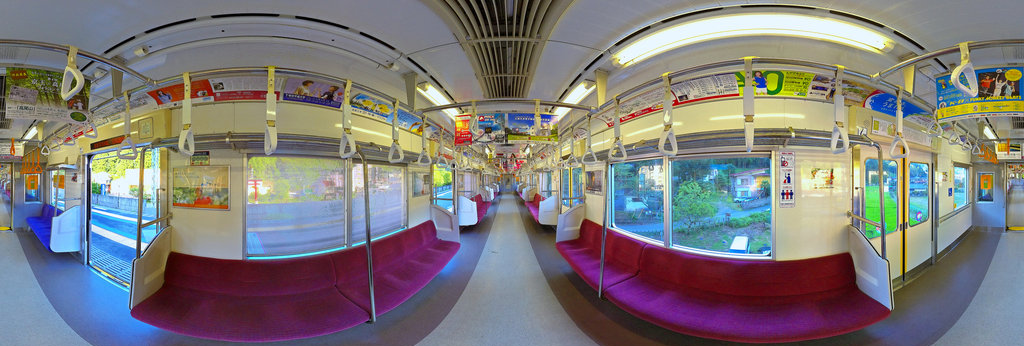
Identify the location of air vents. The image size is (1024, 346). (x=497, y=23).